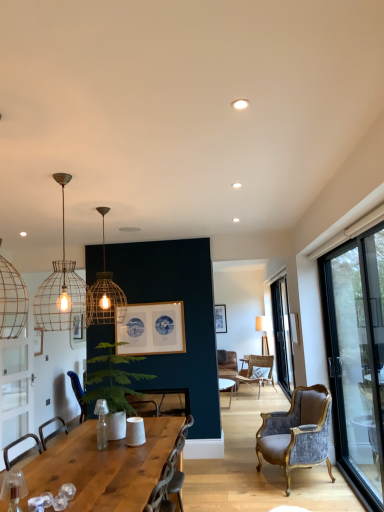
Where is `blank space situated above wooden table at center (from a real-world perspective)`? This screenshot has width=384, height=512. blank space situated above wooden table at center (from a real-world perspective) is located at coordinates [90, 465].